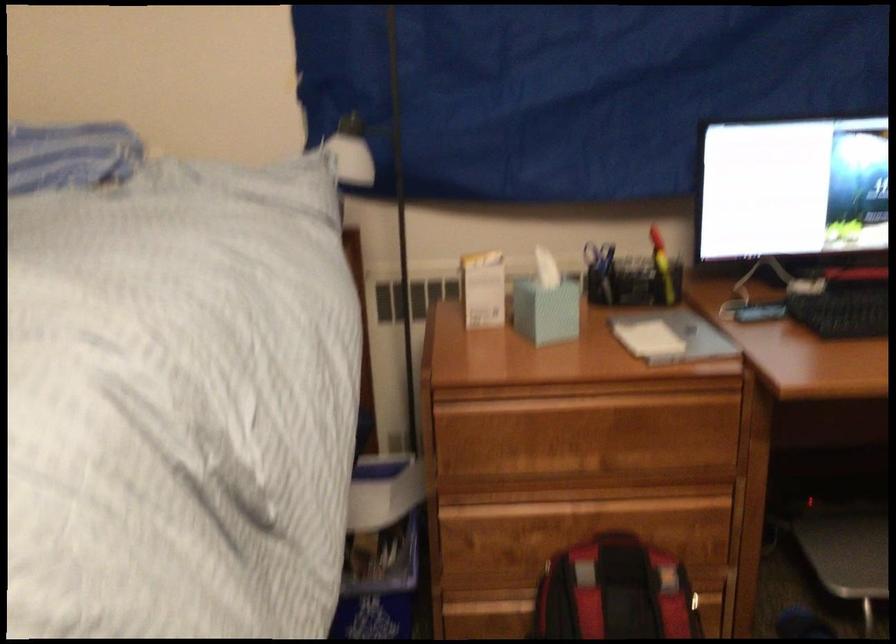
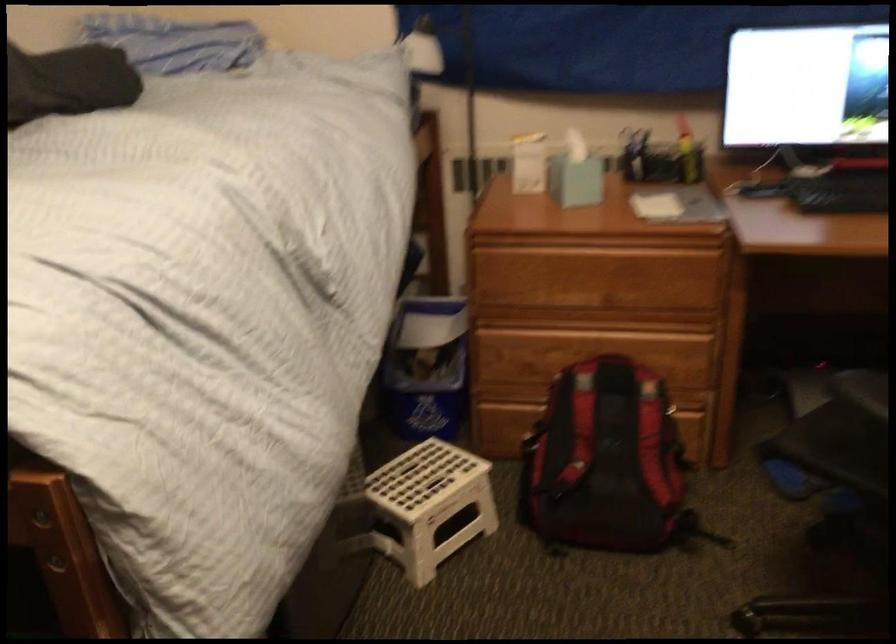
Question: How did the camera likely rotate?

Choices:
 (A) Left
 (B) Right
 (C) Up
 (D) Down

Answer: (A)